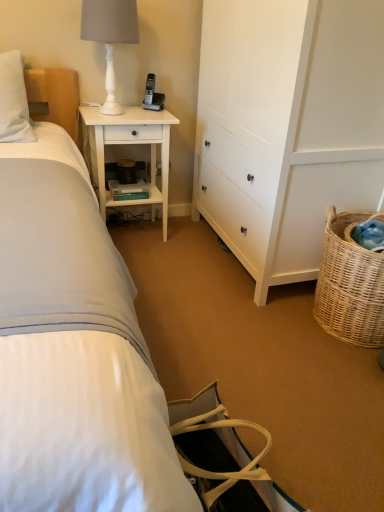
Question: Can you confirm if woven natural basket at lower right is positioned to the left of white wood cabinet at center right?

Choices:
 (A) no
 (B) yes

Answer: (A)

Question: Considering the relative sizes of woven natural basket at lower right and white wood cabinet at center right in the image provided, is woven natural basket at lower right bigger than white wood cabinet at center right?

Choices:
 (A) yes
 (B) no

Answer: (B)

Question: Is woven natural basket at lower right in contact with white wood cabinet at center right?

Choices:
 (A) no
 (B) yes

Answer: (A)

Question: Is woven natural basket at lower right positioned far away from white wood cabinet at center right?

Choices:
 (A) yes
 (B) no

Answer: (B)

Question: Is woven natural basket at lower right further to camera compared to white wood cabinet at center right?

Choices:
 (A) no
 (B) yes

Answer: (B)

Question: Is woven natural basket at lower right smaller than white wood cabinet at center right?

Choices:
 (A) yes
 (B) no

Answer: (A)

Question: Does white wood nightstand at upper left have a lesser width compared to woven natural basket at lower right?

Choices:
 (A) no
 (B) yes

Answer: (B)

Question: Does white wood nightstand at upper left have a larger size compared to woven natural basket at lower right?

Choices:
 (A) yes
 (B) no

Answer: (A)

Question: Is white wood nightstand at upper left further to the viewer compared to woven natural basket at lower right?

Choices:
 (A) yes
 (B) no

Answer: (A)

Question: Can you confirm if white wood nightstand at upper left is smaller than woven natural basket at lower right?

Choices:
 (A) no
 (B) yes

Answer: (A)

Question: Can you confirm if white wood nightstand at upper left is positioned to the left of woven natural basket at lower right?

Choices:
 (A) yes
 (B) no

Answer: (A)

Question: From a real-world perspective, is white wood nightstand at upper left physically below woven natural basket at lower right?

Choices:
 (A) no
 (B) yes

Answer: (A)

Question: Can you confirm if white wood nightstand at upper left is bigger than black plastic phone at upper center?

Choices:
 (A) no
 (B) yes

Answer: (B)